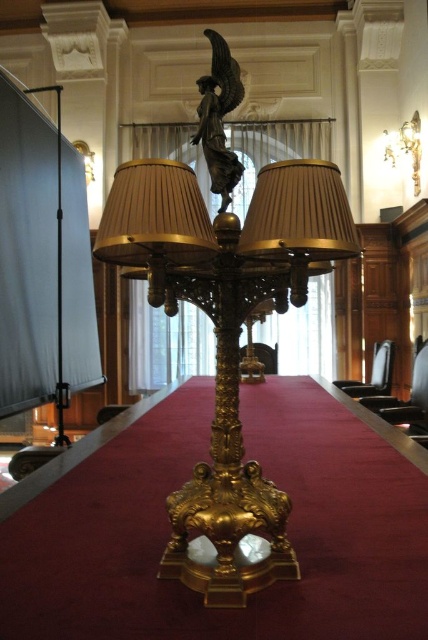
Question: Observing the image, what is the correct spatial positioning of gold/gilded table at center in reference to bronze statue at center?

Choices:
 (A) below
 (B) above

Answer: (A)

Question: Observing the image, what is the correct spatial positioning of gold/gilded table at center in reference to bronze statue at center?

Choices:
 (A) above
 (B) below

Answer: (B)

Question: Which point is farther to the camera?

Choices:
 (A) (413, 116)
 (B) (76, 554)
 (C) (240, 96)

Answer: (A)

Question: Considering the relative positions of bronze statue at center and gold metallic lampshade at upper right in the image provided, where is bronze statue at center located with respect to gold metallic lampshade at upper right?

Choices:
 (A) below
 (B) above

Answer: (A)

Question: Which point is closer to the camera taking this photo?

Choices:
 (A) (379, 456)
 (B) (202, 77)
 (C) (413, 160)

Answer: (B)

Question: Estimate the real-world distances between objects in this image. Which object is closer to the gold/gilded table at center?

Choices:
 (A) gold metallic lampshade at upper right
 (B) bronze statue at center

Answer: (B)